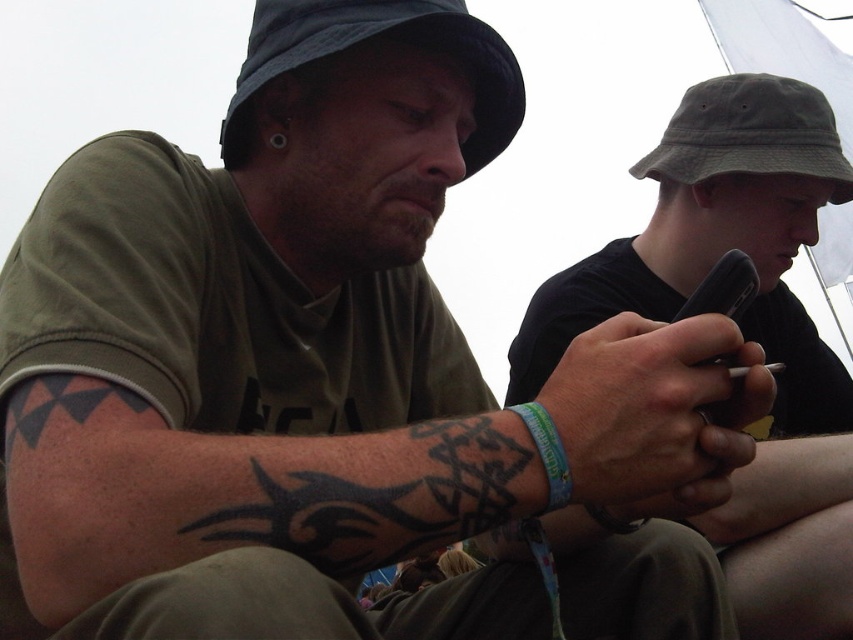
Question: Can you confirm if matte black phone at center is positioned below green fabric baseball cap at upper right?

Choices:
 (A) no
 (B) yes

Answer: (B)

Question: Which of these objects is positioned farthest from the matte black phone at center?

Choices:
 (A) black ink tribal tattoo at lower left
 (B) blue fabric bracelet at lower center

Answer: (B)

Question: Can you confirm if black ink tribal tattoo at lower left is wider than blue fabric bracelet at lower center?

Choices:
 (A) no
 (B) yes

Answer: (B)

Question: Is matte black phone at center smaller than black ink tribal tattoo at lower left?

Choices:
 (A) yes
 (B) no

Answer: (B)

Question: Which object is closer to the camera taking this photo?

Choices:
 (A) dark blue fabric baseball hat at upper left
 (B) green fabric baseball cap at upper right

Answer: (A)

Question: Which point appears farthest from the camera in this image?

Choices:
 (A) (552, 454)
 (B) (294, 456)
 (C) (747, 321)
 (D) (786, 0)

Answer: (D)